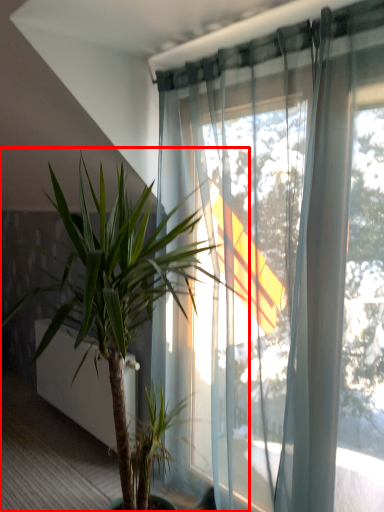
Question: From the image's perspective, where is houseplant (annotated by the red box) located in relation to screen door in the image?

Choices:
 (A) below
 (B) above

Answer: (B)